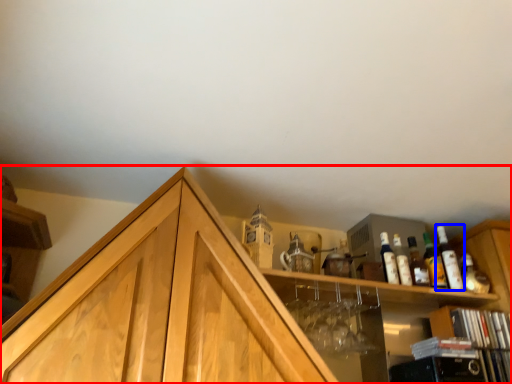
Question: Which point is further to the camera, cabinetry (highlighted by a red box) or bottle (highlighted by a blue box)?

Choices:
 (A) cabinetry
 (B) bottle

Answer: (B)